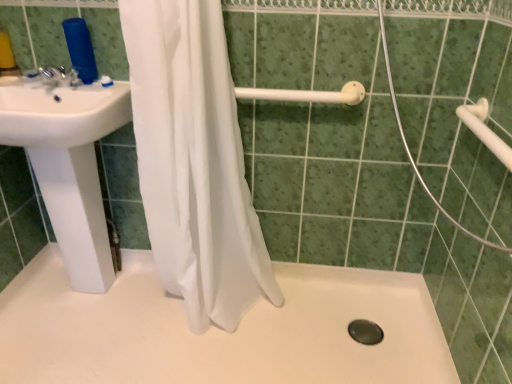
At what (x,y) coordinates should I click in order to perform the action: click on white matte bath at center. Please return your answer as a coordinate pair (x, y). This screenshot has width=512, height=384. Looking at the image, I should click on (218, 330).

Where is `white plastic shower rod at upper center`? This screenshot has width=512, height=384. white plastic shower rod at upper center is located at coordinates (307, 94).

Locate an element on the screen. white sheer curtain at center is located at coordinates (194, 161).

The height and width of the screenshot is (384, 512). What do you see at coordinates (68, 164) in the screenshot?
I see `white glossy sink at left` at bounding box center [68, 164].

In order to face black rubber drain at bottom center, should I rotate leftwards or rightwards?

It's best to rotate right around 14.270 degrees.

Identify the location of white matte bath at center. (218, 330).

Which object is more forward, black rubber drain at bottom center or white sheer curtain at center?

Positioned in front is white sheer curtain at center.

Looking at this image, is white sheer curtain at center completely or partially inside black rubber drain at bottom center?

No, white sheer curtain at center is not surrounded by black rubber drain at bottom center.

Does black rubber drain at bottom center appear on the left side of white sheer curtain at center?

Incorrect, black rubber drain at bottom center is not on the left side of white sheer curtain at center.

Which object is thinner, white plastic shower rod at upper center or black rubber drain at bottom center?

With smaller width is white plastic shower rod at upper center.

From a real-world perspective, is white plastic shower rod at upper center below black rubber drain at bottom center?

Incorrect, from a real-world perspective, white plastic shower rod at upper center is higher than black rubber drain at bottom center.

Can you tell me how much white plastic shower rod at upper center and black rubber drain at bottom center differ in facing direction?

The angular difference between white plastic shower rod at upper center and black rubber drain at bottom center is 2.08 degrees.

Is there a large distance between white plastic shower rod at upper center and black rubber drain at bottom center?

Actually, white plastic shower rod at upper center and black rubber drain at bottom center are a little close together.

What's the angular difference between black rubber drain at bottom center and white glossy sink at left's facing directions?

There is a 3.3-degree angle between the facing directions of black rubber drain at bottom center and white glossy sink at left.

Is black rubber drain at bottom center not within white glossy sink at left?

Yes.

Does black rubber drain at bottom center have a greater width compared to white glossy sink at left?

In fact, black rubber drain at bottom center might be narrower than white glossy sink at left.

Measure the distance from black rubber drain at bottom center to white glossy sink at left.

black rubber drain at bottom center is 1.23 meters from white glossy sink at left.

Is white sheer curtain at center positioned behind white glossy sink at left?

No, white sheer curtain at center is in front of white glossy sink at left.

Is white sheer curtain at center inside the boundaries of white glossy sink at left, or outside?

white sheer curtain at center is not enclosed by white glossy sink at left.

Is white sheer curtain at center at the right side of white glossy sink at left?

Indeed, white sheer curtain at center is positioned on the right side of white glossy sink at left.

Is white plastic shower rod at upper center oriented away from white plastic towel bar at upper right?

No.

From a real-world perspective, does white plastic shower rod at upper center sit lower than white plastic towel bar at upper right?

No.

Where is `shower behind the white plastic towel bar at upper right`? The image size is (512, 384). shower behind the white plastic towel bar at upper right is located at coordinates (307, 94).

Looking at this image, is white plastic shower rod at upper center located outside white plastic towel bar at upper right?

white plastic shower rod at upper center is positioned outside white plastic towel bar at upper right.

From a real-world perspective, is white matte bath at center above or below white matte shower door at center?

white matte bath at center is below white matte shower door at center.

From the image's perspective, is white matte bath at center located above white matte shower door at center?

No, from the image's perspective, white matte bath at center is not over white matte shower door at center.

Which object is wider, white matte bath at center or white matte shower door at center?

Wider between the two is white matte bath at center.

Is point (208, 337) less distant than point (419, 176)?

No, (208, 337) is further to viewer.

Looking at this image, from a real-world perspective, which object rests below the other?

white glossy sink at left is physically lower.

Can you see white glossy sink at left touching white sheer curtain at center?

No.

Which is nearer, (59,223) or (132,108)?

Point (59,223) appears to be farther away from the viewer than point (132,108).

Is white glossy sink at left taller than white sheer curtain at center?

No.

Identify the location of drain located on the right of white sheer curtain at center. Image resolution: width=512 pixels, height=384 pixels. point(365,332).

Where is `drain directly beneath the white plastic shower rod at upper center (from a real-world perspective)`? drain directly beneath the white plastic shower rod at upper center (from a real-world perspective) is located at coordinates click(365, 332).

From the image, which object appears to be farther from white sheer curtain at center, white matte shower door at center or white glossy sink at left?

white matte shower door at center is further to white sheer curtain at center.

From the image, which object appears to be nearer to white matte shower door at center, white plastic towel bar at upper right or white matte bath at center?

The object closer to white matte shower door at center is white plastic towel bar at upper right.

Considering their positions, is black rubber drain at bottom center positioned closer to white glossy sink at left than white matte bath at center?

white matte bath at center is closer to white glossy sink at left.

Which object lies nearer to the anchor point white glossy sink at left, silver metallic faucet at upper left or white matte bath at center?

Based on the image, silver metallic faucet at upper left appears to be nearer to white glossy sink at left.

Which object lies nearer to the anchor point white sheer curtain at center, white plastic shower rod at upper center or white matte bath at center?

white plastic shower rod at upper center is positioned closer to the anchor white sheer curtain at center.

Based on their spatial positions, is white matte shower door at center or silver metallic faucet at upper left further from white sheer curtain at center?

Based on the image, white matte shower door at center appears to be further to white sheer curtain at center.

Estimate the real-world distances between objects in this image. Which object is further from silver metallic faucet at upper left, white plastic towel bar at upper right or white matte shower door at center?

white plastic towel bar at upper right lies further to silver metallic faucet at upper left than the other object.

Estimate the real-world distances between objects in this image. Which object is closer to white sheer curtain at center, silver metallic faucet at upper left or white matte bath at center?

The object closer to white sheer curtain at center is white matte bath at center.

At what (x,y) coordinates should I click in order to perform the action: click on curtain between white glossy sink at left and white plastic shower rod at upper center. Please return your answer as a coordinate pair (x, y). Looking at the image, I should click on (194, 161).

The image size is (512, 384). Find the location of `curtain between silver metallic faucet at upper left and white matte bath at center in the vertical direction`. curtain between silver metallic faucet at upper left and white matte bath at center in the vertical direction is located at coordinates (194, 161).

What are the coordinates of `bath that lies between white plastic shower rod at upper center and black rubber drain at bottom center from top to bottom` in the screenshot? It's located at (218, 330).

Identify the location of tap situated between white glossy sink at left and black rubber drain at bottom center from left to right. Image resolution: width=512 pixels, height=384 pixels. (52, 77).